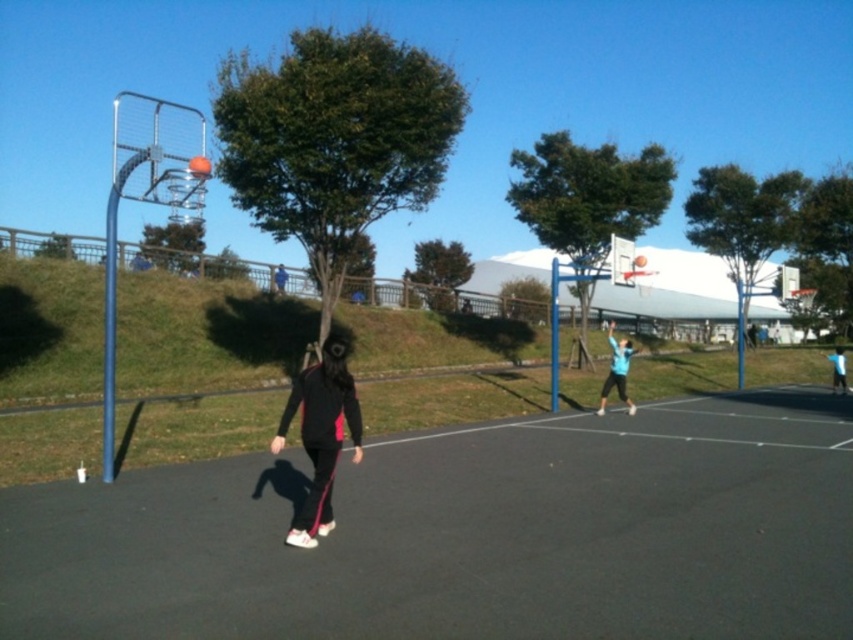
Does blue matte basketball player at upper right have a lesser height compared to black fabric jacket at center?

No, blue matte basketball player at upper right is not shorter than black fabric jacket at center.

Does blue matte basketball player at upper right appear on the right side of black fabric jacket at center?

Correct, you'll find blue matte basketball player at upper right to the right of black fabric jacket at center.

Is point (624, 369) closer to camera compared to point (277, 278)?

Yes, it is.

Where is `blue matte basketball player at upper right`? blue matte basketball player at upper right is located at coordinates (618, 371).

Which is more to the right, blue fabric shirt at right or black fabric jacket at center?

Positioned to the right is blue fabric shirt at right.

Does blue fabric shirt at right lie in front of black fabric jacket at center?

Yes.

Is point (844, 392) more distant than point (281, 268)?

No, (844, 392) is in front of (281, 268).

This screenshot has width=853, height=640. What are the coordinates of `blue fabric shirt at right` in the screenshot? It's located at (838, 369).

Between point (689, 627) and point (277, 278), which one is positioned behind?

The point (277, 278) is behind.

Does black fabric court at center appear over black fabric jacket at center?

Incorrect, black fabric court at center is not positioned above black fabric jacket at center.

Who is more distant from viewer, (688, 476) or (274, 282)?

The point (274, 282) is more distant.

Locate an element on the screen. The height and width of the screenshot is (640, 853). black fabric court at center is located at coordinates (467, 536).